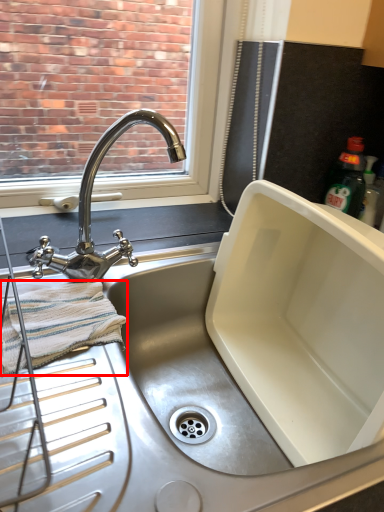
Question: Considering the relative positions of bath towel (annotated by the red box) and tap in the image provided, where is bath towel (annotated by the red box) located with respect to the staircase?

Choices:
 (A) left
 (B) right

Answer: (A)